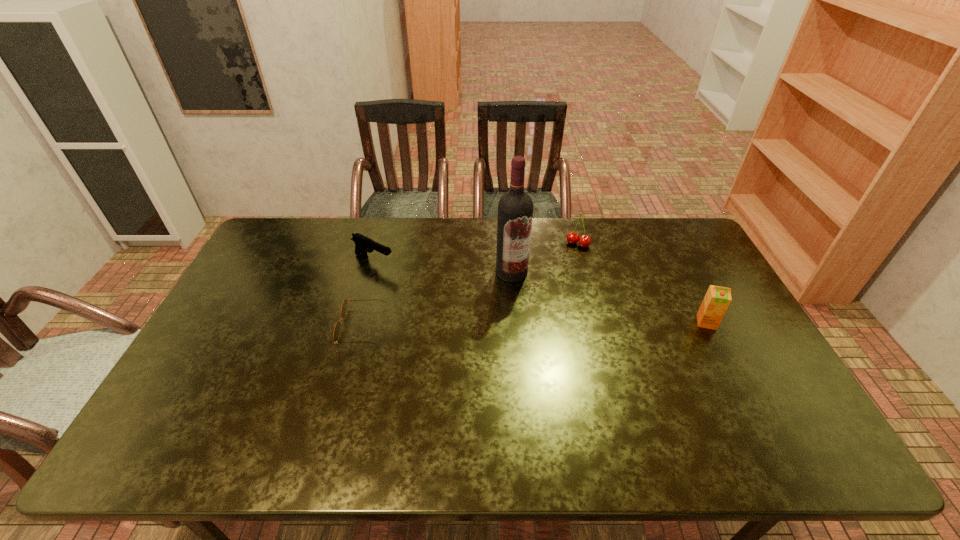
Locate which object is the second closest to the pistol. Please provide its 2D coordinates. Your answer should be formatted as a tuple, i.e. [(x, y)], where the tuple contains the x and y coordinates of a point satisfying the conditions above.

[(515, 208)]

Identify which object is the nearest to the third object from left to right. Please provide its 2D coordinates. Your answer should be formatted as a tuple, i.e. [(x, y)], where the tuple contains the x and y coordinates of a point satisfying the conditions above.

[(584, 241)]

Find the location of a particular element. blank area in the image that satisfies the following two spatial constraints: 1. on the front side of the pistol; 2. on the face of the shortest object is located at coordinates (355, 326).

This screenshot has width=960, height=540. Identify the location of free space in the image that satisfies the following two spatial constraints: 1. on the back side of the third object from left to right; 2. on the right side of the fourth object from left to right. (510, 244).